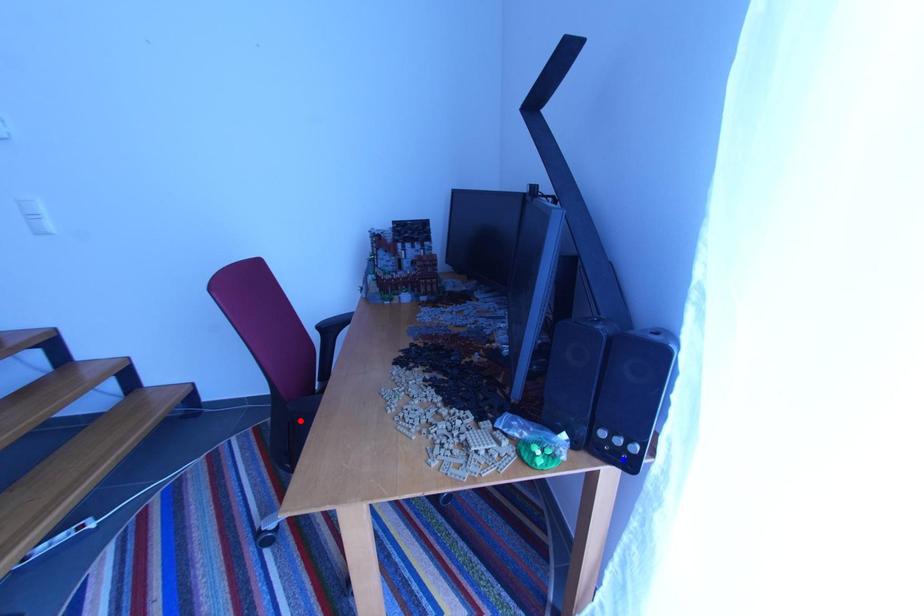
Question: Two points are marked on the image. Which point is closer to the camera?

Choices:
 (A) Blue point is closer.
 (B) Red point is closer.

Answer: (A)